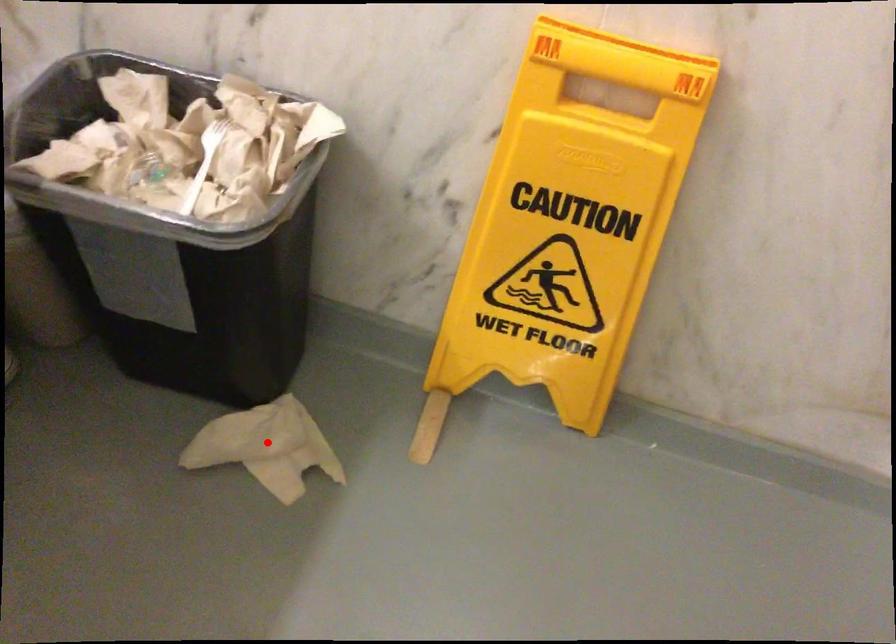
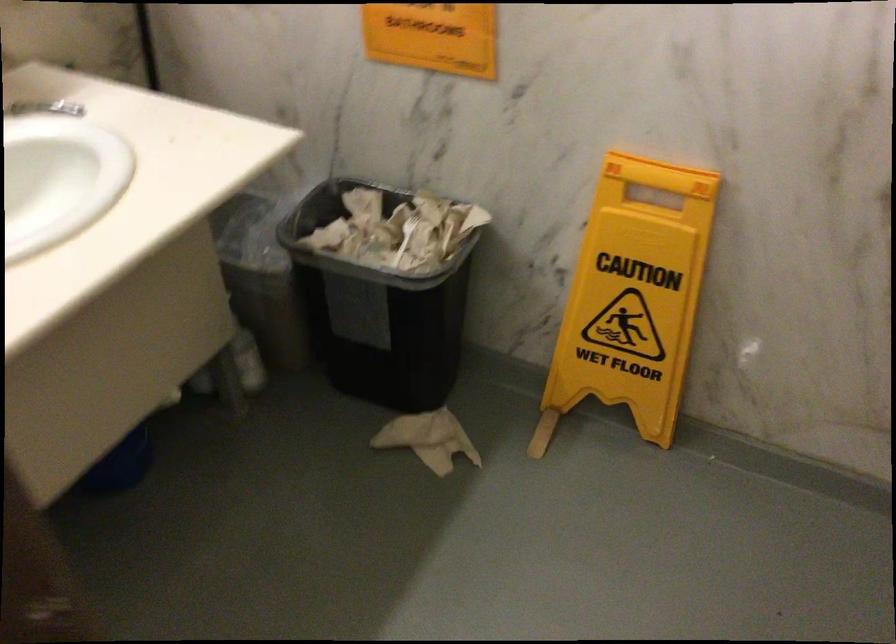
Question: I am providing you with two images of the same scene from different viewpoints. In image1, a red point is highlighted. Considering the same 3D point in image2, which of the following is correct?

Choices:
 (A) It is closer
 (B) It is farther

Answer: (B)